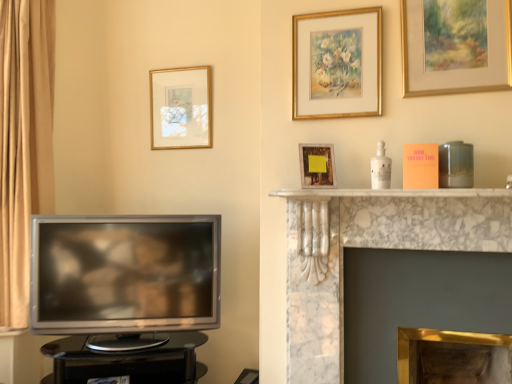
Question: Looking at their shapes, would you say white marble fireplace at center, which appears as the 1th fireplace when viewed from the top, is wider or thinner than gold-framed picture at upper center, the 4th picture frame positioned from the right?

Choices:
 (A) wide
 (B) thin

Answer: (A)

Question: Is white marble fireplace at center, which appears as the 1th fireplace when viewed from the top, spatially inside gold-framed picture at upper center, positioned as the first picture frame in back-to-front order, or outside of it?

Choices:
 (A) outside
 (B) inside

Answer: (A)

Question: Estimate the real-world distances between objects in this image. Which object is closer to the gold-framed painting at upper right, the 1th picture frame viewed from the front?

Choices:
 (A) satin silver television at left
 (B) white marble fireplace at upper center
 (C) gold/gilded picture frame at upper center, the 3th picture frame positioned from the front
 (D) gold metallic fireplace at center, acting as the 1th fireplace starting from the bottom
 (E) white marble fireplace at center, acting as the 2th fireplace starting from the bottom

Answer: (C)

Question: Which object is positioned farthest from the gold/gilded picture frame at upper center, the 3th picture frame positioned from the front?

Choices:
 (A) satin silver television at left
 (B) gold metallic fireplace at center, the 2th fireplace positioned from the top
 (C) black glossy table at lower left
 (D) gold-framed painting at upper right, which is the 4th picture frame from back to front
 (E) matte wooden picture frame at upper center, acting as the 2th picture frame starting from the front

Answer: (C)